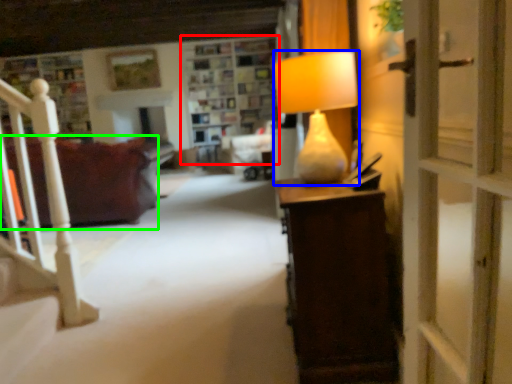
Question: Which object is the farthest from shelf (highlighted by a red box)? Choose among these: lamp (highlighted by a blue box) or studio couch (highlighted by a green box).

Choices:
 (A) lamp
 (B) studio couch

Answer: (A)